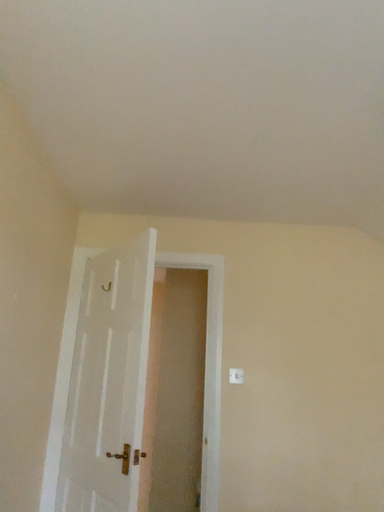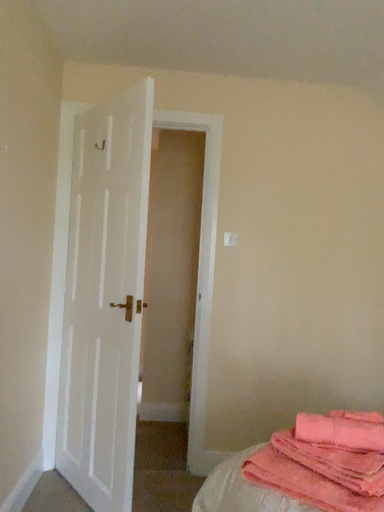
Question: How did the camera likely rotate when shooting the video?

Choices:
 (A) rotated downward
 (B) rotated upward

Answer: (A)